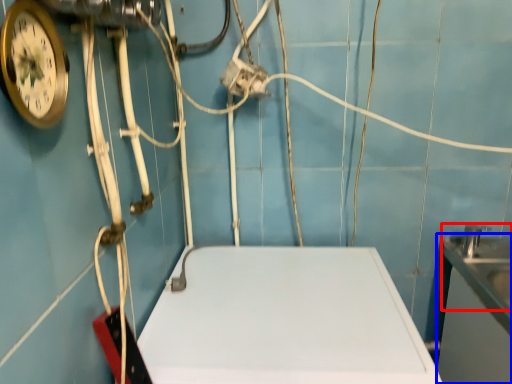
Question: Which of the following is the farthest to the observer, sink (highlighted by a red box) or counter top (highlighted by a blue box)?

Choices:
 (A) sink
 (B) counter top

Answer: (A)